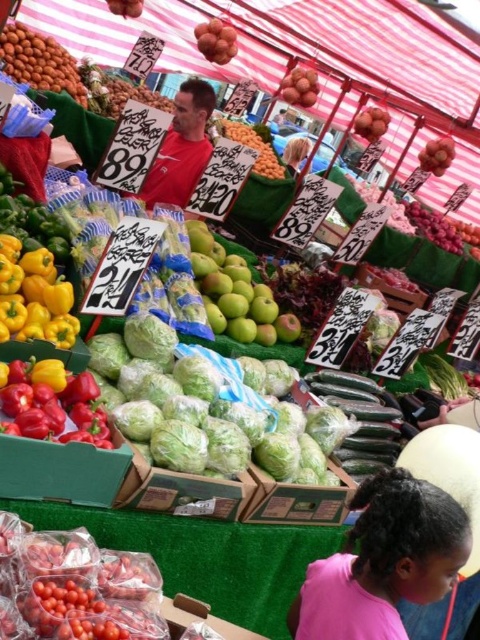
Question: Is pink fabric at lower right positioned at the back of red matte shirt at center?

Choices:
 (A) yes
 (B) no

Answer: (B)

Question: Which of these objects is positioned farthest from the orange matte at upper center?

Choices:
 (A) shiny brown nuts at upper center
 (B) blonde hair at upper center

Answer: (B)

Question: Can you confirm if orange matte at upper center is wider than blonde hair at upper center?

Choices:
 (A) no
 (B) yes

Answer: (B)

Question: Is pink fabric at lower right to the left of ripe orange at upper center from the viewer's perspective?

Choices:
 (A) no
 (B) yes

Answer: (B)

Question: Which of the following is the closest to the observer?

Choices:
 (A) ripe orange at upper center
 (B) blonde hair at upper center
 (C) ripe red tomato at center
 (D) smooth red tomato at upper left

Answer: (D)

Question: Which of the following is the farthest from the observer?

Choices:
 (A) click(x=224, y=42)
 (B) click(x=283, y=88)
 (C) click(x=298, y=147)

Answer: (C)